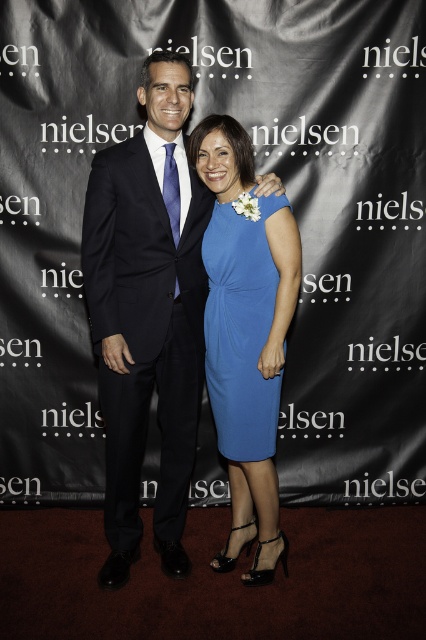
You are standing at the event and want to take a closer look at the matte black suit at center. If you walk 5 feet towards it, will you be able to touch it?

The matte black suit at center is 7.30 feet away from the viewer. If you walk 5 feet towards it, you will still be 2.30 feet away and cannot touch it.